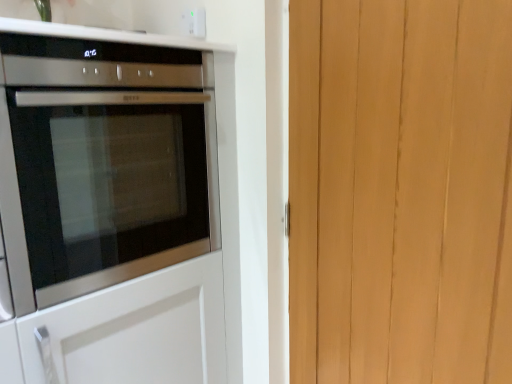
Question: Is white plastic electric outlet at upper center to the left of light brown wood at right from the viewer's perspective?

Choices:
 (A) no
 (B) yes

Answer: (B)

Question: Is white plastic electric outlet at upper center to the right of light brown wood at right from the viewer's perspective?

Choices:
 (A) yes
 (B) no

Answer: (B)

Question: From the image's perspective, does white plastic electric outlet at upper center appear higher than light brown wood at right?

Choices:
 (A) yes
 (B) no

Answer: (A)

Question: Is white plastic electric outlet at upper center located outside light brown wood at right?

Choices:
 (A) yes
 (B) no

Answer: (A)

Question: From the image's perspective, is white plastic electric outlet at upper center located beneath light brown wood at right?

Choices:
 (A) yes
 (B) no

Answer: (B)

Question: In the image, is light brown wood at right on the left side or the right side of satin silver oven at left?

Choices:
 (A) right
 (B) left

Answer: (A)

Question: From a real-world perspective, relative to satin silver oven at left, is light brown wood at right vertically above or below?

Choices:
 (A) below
 (B) above

Answer: (A)

Question: Considering the positions of light brown wood at right and satin silver oven at left in the image, is light brown wood at right bigger or smaller than satin silver oven at left?

Choices:
 (A) big
 (B) small

Answer: (B)

Question: Is light brown wood at right taller or shorter than satin silver oven at left?

Choices:
 (A) tall
 (B) short

Answer: (A)

Question: Is light brown wood at right taller or shorter than white plastic electric outlet at upper center?

Choices:
 (A) short
 (B) tall

Answer: (B)

Question: Is point (471, 334) closer or farther from the camera than point (187, 13)?

Choices:
 (A) closer
 (B) farther

Answer: (A)

Question: Is light brown wood at right to the left or to the right of white plastic electric outlet at upper center in the image?

Choices:
 (A) left
 (B) right

Answer: (B)

Question: Which is correct: light brown wood at right is inside white plastic electric outlet at upper center, or outside of it?

Choices:
 (A) outside
 (B) inside

Answer: (A)

Question: Considering the positions of satin silver oven at left and light brown wood at right in the image, is satin silver oven at left bigger or smaller than light brown wood at right?

Choices:
 (A) big
 (B) small

Answer: (A)

Question: Based on their positions, is satin silver oven at left located to the left or right of light brown wood at right?

Choices:
 (A) right
 (B) left

Answer: (B)